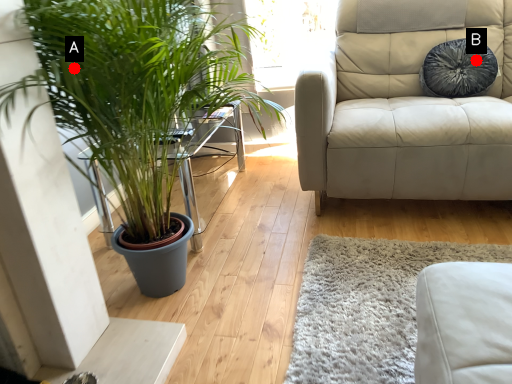
Question: Two points are circled on the image, labeled by A and B beside each circle. Which of the following is the farthest from the observer?

Choices:
 (A) A is further
 (B) B is further

Answer: (B)